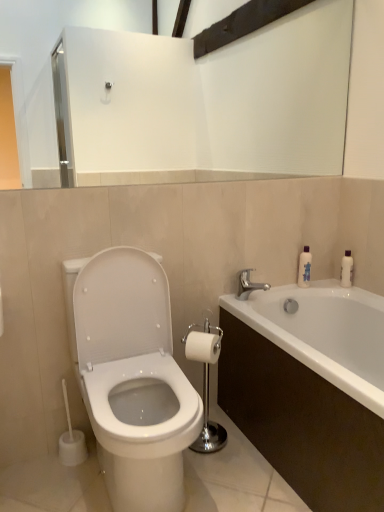
Question: Is translucent plastic bottle at upper right further to camera compared to white glossy bathtub at lower right?

Choices:
 (A) yes
 (B) no

Answer: (A)

Question: Does translucent plastic bottle at upper right appear on the left side of white glossy bathtub at lower right?

Choices:
 (A) no
 (B) yes

Answer: (B)

Question: Are translucent plastic bottle at upper right and white glossy bathtub at lower right far apart?

Choices:
 (A) yes
 (B) no

Answer: (B)

Question: Is translucent plastic bottle at upper right closer to camera compared to white glossy bathtub at lower right?

Choices:
 (A) no
 (B) yes

Answer: (A)

Question: Is translucent plastic bottle at upper right positioned beyond the bounds of white glossy bathtub at lower right?

Choices:
 (A) no
 (B) yes

Answer: (B)

Question: From the image's perspective, does translucent plastic bottle at upper right appear higher than white glossy bathtub at lower right?

Choices:
 (A) yes
 (B) no

Answer: (A)

Question: Does white matte toilet paper at center have a smaller size compared to polished chrome toilet paper holder at center?

Choices:
 (A) yes
 (B) no

Answer: (A)

Question: Does white matte toilet paper at center have a greater height compared to polished chrome toilet paper holder at center?

Choices:
 (A) no
 (B) yes

Answer: (A)

Question: Is white matte toilet paper at center outside of polished chrome toilet paper holder at center?

Choices:
 (A) no
 (B) yes

Answer: (A)

Question: From a real-world perspective, is white matte toilet paper at center below polished chrome toilet paper holder at center?

Choices:
 (A) yes
 (B) no

Answer: (B)

Question: Considering the relative sizes of white matte toilet paper at center and polished chrome toilet paper holder at center in the image provided, is white matte toilet paper at center wider than polished chrome toilet paper holder at center?

Choices:
 (A) yes
 (B) no

Answer: (B)

Question: Is white matte toilet paper at center directly adjacent to polished chrome toilet paper holder at center?

Choices:
 (A) yes
 (B) no

Answer: (B)

Question: Does white matte toilet paper at center have a smaller size compared to silver metallic faucet at upper right?

Choices:
 (A) yes
 (B) no

Answer: (B)